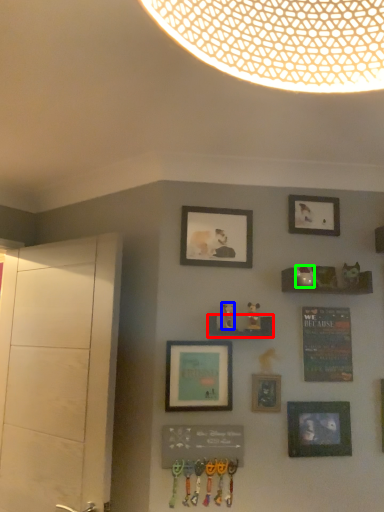
Question: Which object is positioned farthest from shelf (highlighted by a red box)? Select from art (highlighted by a blue box) and art (highlighted by a green box).

Choices:
 (A) art
 (B) art

Answer: (B)